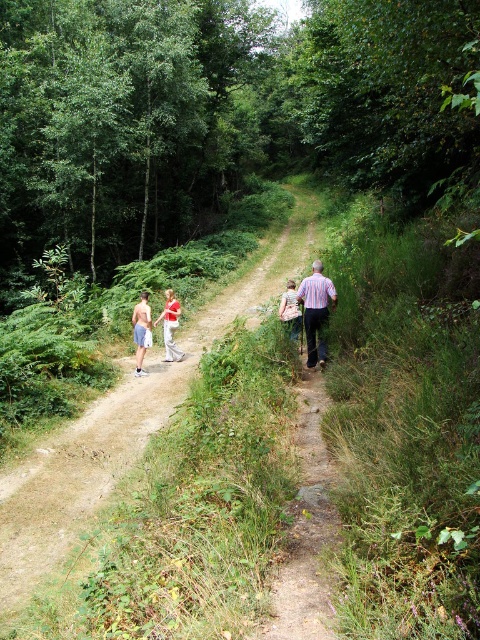
Who is positioned more to the right, light blue denim shorts at center or light brown fabric shirt at center?

From the viewer's perspective, light brown fabric shirt at center appears more on the right side.

Find the location of a particular element. The image size is (480, 640). light blue denim shorts at center is located at coordinates (169, 326).

Which is behind, point (165, 342) or point (285, 308)?

The point (165, 342) is behind.

The height and width of the screenshot is (640, 480). Identify the location of light blue denim shorts at center. (169, 326).

Is point (323, 310) positioned before point (156, 321)?

Yes, point (323, 310) is closer to viewer.

Can you confirm if striped shirt at center is taller than light blue denim shorts at center?

Yes, striped shirt at center is taller than light blue denim shorts at center.

Is point (308, 355) farther from viewer compared to point (176, 346)?

No, (308, 355) is closer to viewer.

The width and height of the screenshot is (480, 640). In order to click on striped shirt at center in this screenshot , I will do `click(315, 310)`.

Is dirt path at center closer to camera compared to light blue denim shorts at center?

Yes, dirt path at center is closer to the viewer.

What do you see at coordinates (116, 433) in the screenshot? I see `dirt path at center` at bounding box center [116, 433].

This screenshot has width=480, height=640. What do you see at coordinates (116, 433) in the screenshot?
I see `dirt path at center` at bounding box center [116, 433].

Find the location of a particular element. dirt path at center is located at coordinates (116, 433).